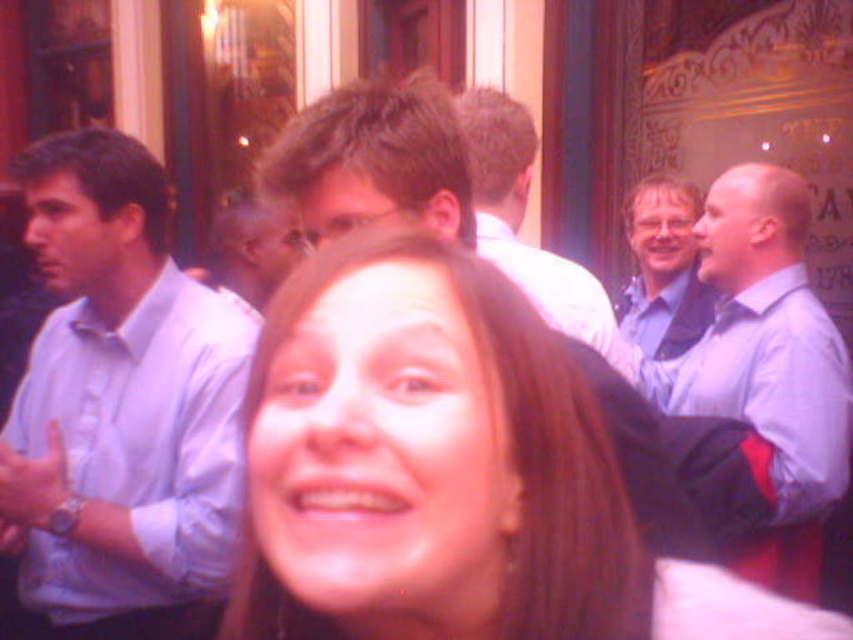
You are a photographer at the event and want to capture a group photo of the matte white shirt at center and the blue shirt at center. The camera you are using has a maximum focus range of 3 meters. Will both subjects be in focus if you position the camera exactly between them?

The matte white shirt at center and blue shirt at center are 2.93 meters apart from each other. Positioning the camera exactly between them would mean each subject is 1.465 meters away from the camera. Since the maximum focus range is 3 meters, both subjects will be within the focus range and thus in focus.

You are a photographer adjusting the camera focus. You need to ensure both the smooth skin face at center and the blue shirt at center are in focus. Which object should you focus on first to ensure depth of field covers both?

The smooth skin face at center has a lesser height compared to blue shirt at center. Focus on the blue shirt at center first since it is farther away, allowing the depth of field to include both the closer face and the shirt.